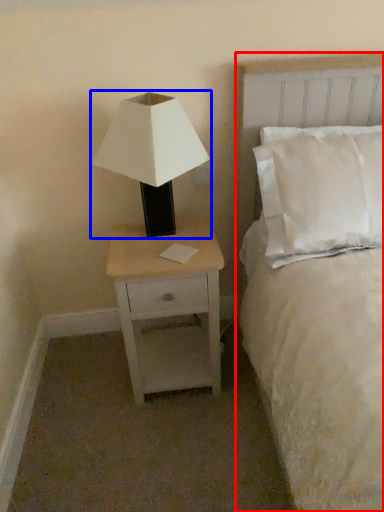
Question: Among these objects, which one is farthest to the camera, bed (highlighted by a red box) or lamp (highlighted by a blue box)?

Choices:
 (A) bed
 (B) lamp

Answer: (B)